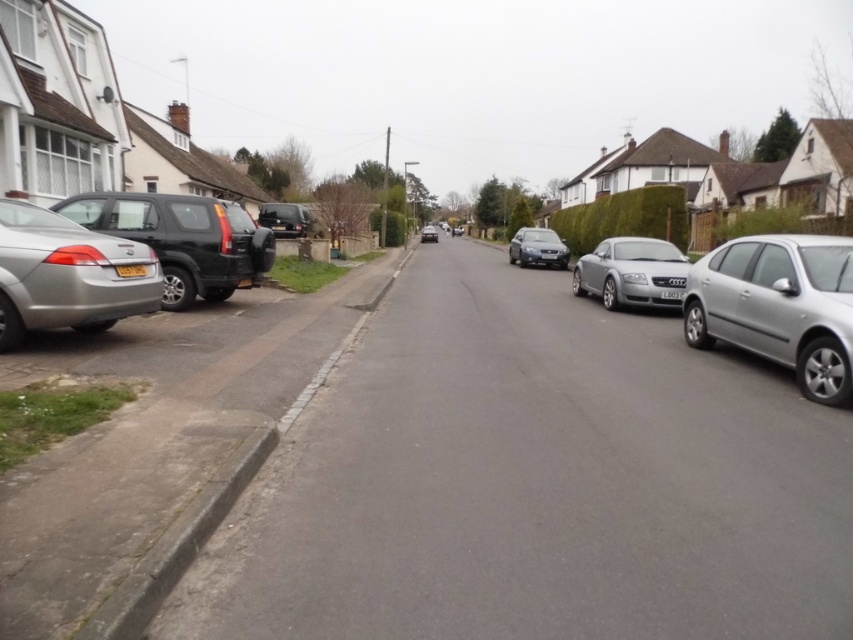
You are a delivery driver who needs to park your van between the silver metallic sedan at left and the shiny black suv at left. Is there enough space between them for your van that is 5 meters long?

The silver metallic sedan at left is positioned on the left side of shiny black suv at left. However, the exact distance between them is not provided, so it is uncertain if there is enough space for a van that is 5 meters long.

You are a delivery drone that needs to fly over the silver metallic car at center and the black plastic license plate at center. What should you be cautious about regarding their heights?

The silver metallic car at center is taller than the black plastic license plate at center, so you should ensure the drone flies above the silver metallic car at center to avoid collision.